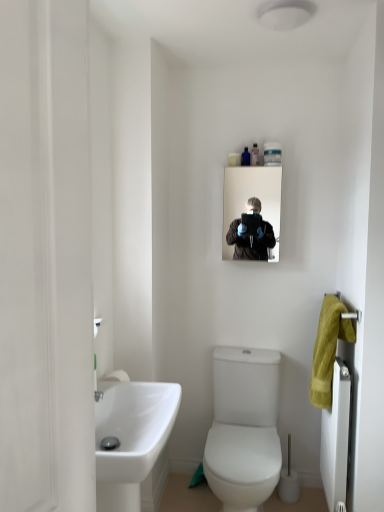
Question: Considering the relative sizes of white glossy sink at lower left and translucent plastic bottle at upper center, arranged as the first toiletry when viewed from the left, in the image provided, is white glossy sink at lower left taller than translucent plastic bottle at upper center, arranged as the first toiletry when viewed from the left,?

Choices:
 (A) yes
 (B) no

Answer: (A)

Question: Is translucent plastic bottle at upper center, arranged as the first toiletry when viewed from the left, at the back of white glossy sink at lower left?

Choices:
 (A) yes
 (B) no

Answer: (B)

Question: Is white glossy sink at lower left aimed at translucent plastic bottle at upper center, which ranks as the 3th toiletry in right-to-left order?

Choices:
 (A) no
 (B) yes

Answer: (A)

Question: Is white glossy sink at lower left not close to translucent plastic bottle at upper center, arranged as the first toiletry when viewed from the left?

Choices:
 (A) no
 (B) yes

Answer: (B)

Question: Considering the relative sizes of white glossy sink at lower left and translucent plastic bottle at upper center, arranged as the first toiletry when viewed from the left, in the image provided, is white glossy sink at lower left shorter than translucent plastic bottle at upper center, arranged as the first toiletry when viewed from the left,?

Choices:
 (A) no
 (B) yes

Answer: (A)

Question: Considering the positions of white textured radiator at right and translucent plastic bottle at upper center, positioned as the second toiletry in left-to-right order, in the image, is white textured radiator at right wider or thinner than translucent plastic bottle at upper center, positioned as the second toiletry in left-to-right order,?

Choices:
 (A) thin
 (B) wide

Answer: (B)

Question: Is white textured radiator at right taller or shorter than translucent plastic bottle at upper center, positioned as the second toiletry in left-to-right order?

Choices:
 (A) tall
 (B) short

Answer: (A)

Question: Considering the positions of white textured radiator at right and translucent plastic bottle at upper center, which ranks as the second toiletry in right-to-left order, in the image, is white textured radiator at right bigger or smaller than translucent plastic bottle at upper center, which ranks as the second toiletry in right-to-left order,?

Choices:
 (A) big
 (B) small

Answer: (A)

Question: From a real-world perspective, is white textured radiator at right positioned above or below translucent plastic bottle at upper center, positioned as the second toiletry in left-to-right order?

Choices:
 (A) below
 (B) above

Answer: (A)

Question: Is white matte screen door at left taller or shorter than translucent plastic bottle at upper center, which is counted as the 3th toiletry, starting from the left?

Choices:
 (A) short
 (B) tall

Answer: (B)

Question: Does point (74, 506) appear closer or farther from the camera than point (253, 152)?

Choices:
 (A) farther
 (B) closer

Answer: (B)

Question: Based on their sizes in the image, would you say white matte screen door at left is bigger or smaller than translucent plastic bottle at upper center, which is counted as the 3th toiletry, starting from the left?

Choices:
 (A) small
 (B) big

Answer: (B)

Question: From a real-world perspective, is white matte screen door at left physically located above or below translucent plastic bottle at upper center, the first toiletry from the right?

Choices:
 (A) above
 (B) below

Answer: (B)

Question: Is point (11, 123) positioned closer to the camera than point (244, 384)?

Choices:
 (A) closer
 (B) farther

Answer: (A)

Question: From a real-world perspective, relative to white glossy toilet at center, is white matte screen door at left vertically above or below?

Choices:
 (A) above
 (B) below

Answer: (A)